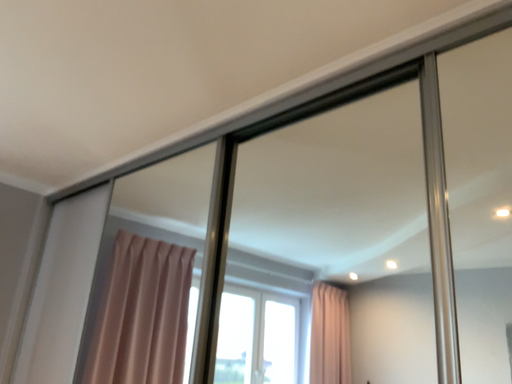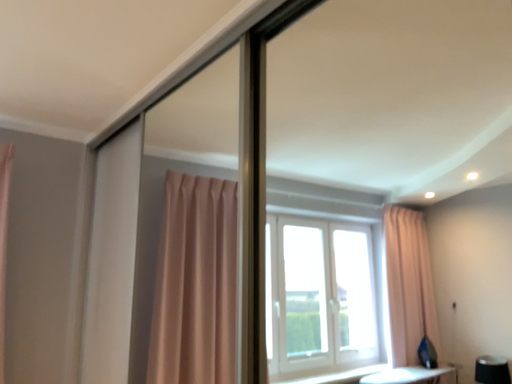
Question: Which way did the camera rotate in the video?

Choices:
 (A) rotated upward
 (B) rotated downward

Answer: (B)